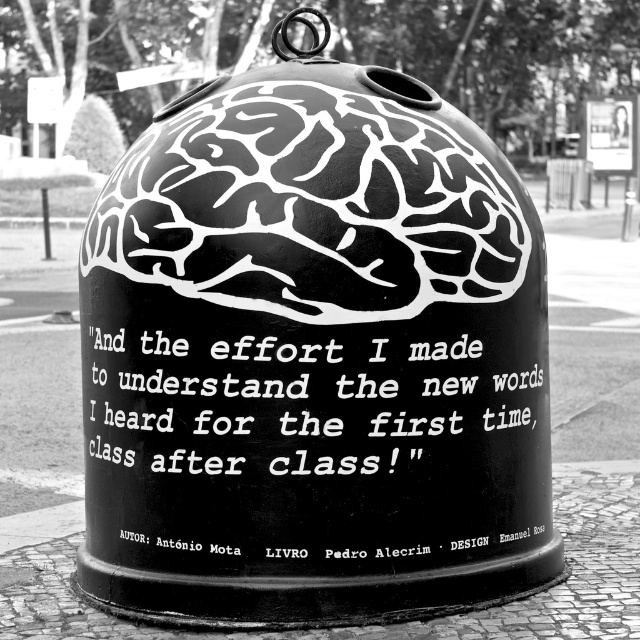
Is white matte text at center below black metal pole at left?

Yes.

Is point (394, 408) more distant than point (45, 234)?

No, (394, 408) is closer to viewer.

Describe the element at coordinates (300, 403) in the screenshot. I see `white matte text at center` at that location.

Find the location of `white matte text at center`. white matte text at center is located at coordinates (300, 403).